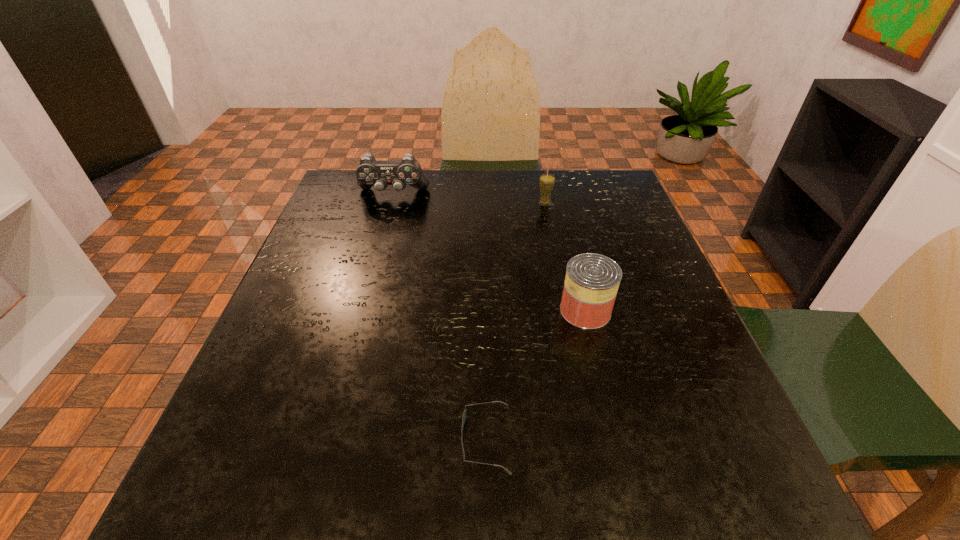
At what (x,y) coordinates should I click in order to perform the action: click on free space that is in between the third object from right to left and the leftmost object. Please return your answer as a coordinate pair (x, y). Image resolution: width=960 pixels, height=540 pixels. Looking at the image, I should click on (440, 317).

Image resolution: width=960 pixels, height=540 pixels. Identify the location of vacant space in between the leftmost object and the straw for drinking. (468, 199).

Find the location of a particular element. free space between the straw for drinking and the can is located at coordinates (564, 256).

Where is `object that can be found as the closest to the second object from left to right`? The image size is (960, 540). object that can be found as the closest to the second object from left to right is located at coordinates (592, 280).

Locate which object ranks in proximity to the can. Please provide its 2D coordinates. Your answer should be formatted as a tuple, i.e. [(x, y)], where the tuple contains the x and y coordinates of a point satisfying the conditions above.

[(464, 414)]

Locate an element on the screen. The image size is (960, 540). vacant area in the image that satisfies the following two spatial constraints: 1. on the surface of the straw for drinking with buttons; 2. on the right side of the control is located at coordinates (391, 203).

You are a GUI agent. You are given a task and a screenshot of the screen. Output one action in this format:
    pyautogui.click(x=<x>, y=<y>)
    Task: Click on the free space in the image that satisfies the following two spatial constraints: 1. on the surface of the can with buttons; 2. on the left side of the leftmost object
    The height and width of the screenshot is (540, 960).
    Given the screenshot: What is the action you would take?
    pyautogui.click(x=361, y=310)

This screenshot has width=960, height=540. I want to click on blank area in the image that satisfies the following two spatial constraints: 1. on the front side of the third farthest object; 2. on the lenses of the shortest object, so click(x=616, y=439).

Locate an element on the screen. The height and width of the screenshot is (540, 960). blank area in the image that satisfies the following two spatial constraints: 1. on the surface of the leftmost object with buttons; 2. on the right side of the straw for drinking is located at coordinates (391, 203).